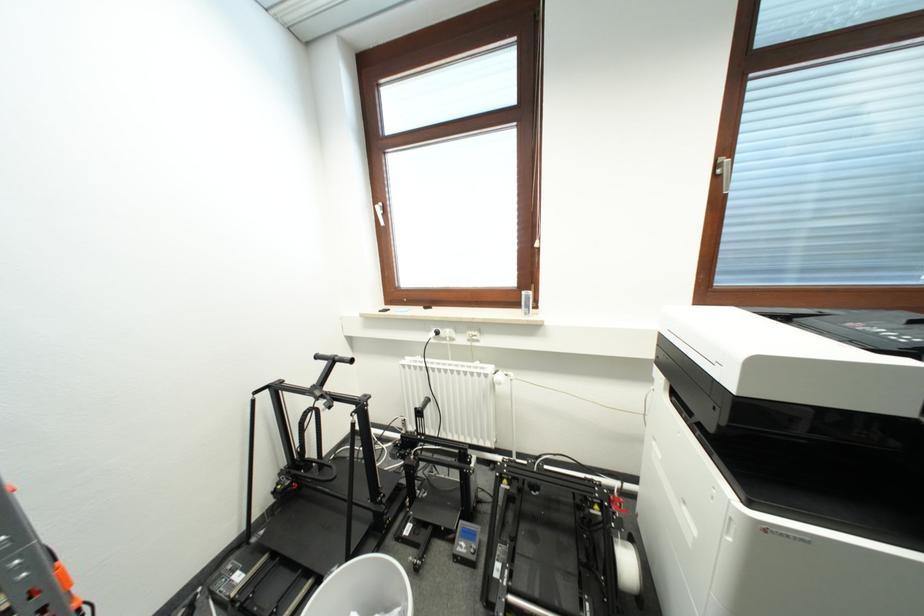
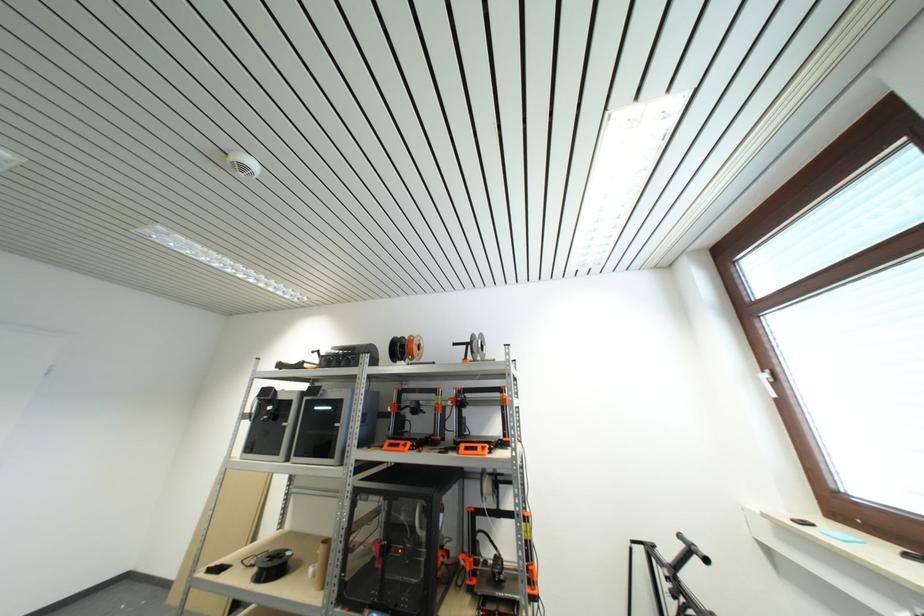
Locate, in the second image, the point that corresponds to the point at 322,360 in the first image.

(685, 540)